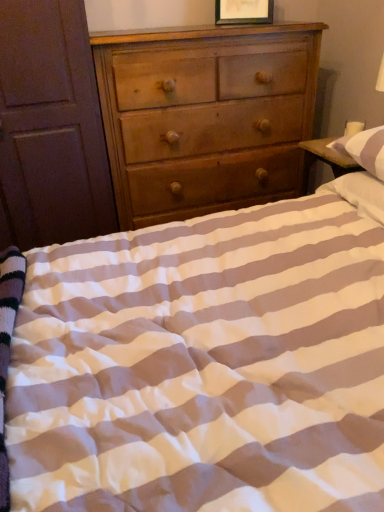
Question: In which direction should I rotate to look at light brown wood chest of drawers at center?

Choices:
 (A) left
 (B) right

Answer: (B)

Question: Is white striped pillow at upper right touching light brown wood chest of drawers at center?

Choices:
 (A) no
 (B) yes

Answer: (A)

Question: Is white striped pillow at upper right to the left of light brown wood chest of drawers at center from the viewer's perspective?

Choices:
 (A) yes
 (B) no

Answer: (B)

Question: Would you say light brown wood chest of drawers at center is part of white striped pillow at upper right's contents?

Choices:
 (A) no
 (B) yes

Answer: (A)

Question: Is white striped pillow at upper right completely or partially outside of light brown wood chest of drawers at center?

Choices:
 (A) no
 (B) yes

Answer: (B)

Question: Is the depth of white striped pillow at upper right less than that of light brown wood chest of drawers at center?

Choices:
 (A) yes
 (B) no

Answer: (A)

Question: From a real-world perspective, is white striped pillow at upper right positioned under light brown wood chest of drawers at center based on gravity?

Choices:
 (A) yes
 (B) no

Answer: (A)

Question: Is white striped pillow at upper right in contact with wooden picture frame at upper center?

Choices:
 (A) no
 (B) yes

Answer: (A)

Question: Can you confirm if white striped pillow at upper right is thinner than wooden picture frame at upper center?

Choices:
 (A) no
 (B) yes

Answer: (A)

Question: Does white striped pillow at upper right have a greater height compared to wooden picture frame at upper center?

Choices:
 (A) yes
 (B) no

Answer: (B)

Question: Is white striped pillow at upper right smaller than wooden picture frame at upper center?

Choices:
 (A) yes
 (B) no

Answer: (B)

Question: Considering the relative sizes of white striped pillow at upper right and wooden picture frame at upper center in the image provided, is white striped pillow at upper right shorter than wooden picture frame at upper center?

Choices:
 (A) no
 (B) yes

Answer: (B)

Question: Is white striped pillow at upper right to the left of wooden picture frame at upper center from the viewer's perspective?

Choices:
 (A) yes
 (B) no

Answer: (B)

Question: From the image's perspective, does brown wooden armoire at left appear lower than light brown wood chest of drawers at center?

Choices:
 (A) yes
 (B) no

Answer: (A)